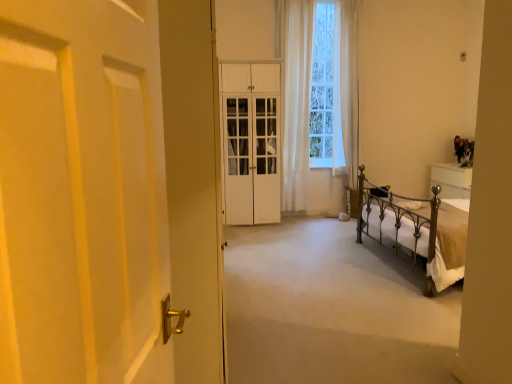
Question: Considering the relative positions of white glossy cabinet at center and white matte door at left in the image provided, is white glossy cabinet at center in front of white matte door at left?

Choices:
 (A) yes
 (B) no

Answer: (B)

Question: Can you confirm if white glossy cabinet at center is bigger than white matte door at left?

Choices:
 (A) yes
 (B) no

Answer: (A)

Question: Does white glossy cabinet at center have a greater height compared to white matte door at left?

Choices:
 (A) yes
 (B) no

Answer: (A)

Question: From the image's perspective, is white glossy cabinet at center under white matte door at left?

Choices:
 (A) no
 (B) yes

Answer: (A)

Question: Is white glossy cabinet at center next to white matte door at left and touching it?

Choices:
 (A) no
 (B) yes

Answer: (A)

Question: Is white matte door at left inside the boundaries of white carpet at center, or outside?

Choices:
 (A) inside
 (B) outside

Answer: (B)

Question: From a real-world perspective, is white matte door at left physically located above or below white carpet at center?

Choices:
 (A) above
 (B) below

Answer: (A)

Question: In terms of height, does white matte door at left look taller or shorter compared to white carpet at center?

Choices:
 (A) tall
 (B) short

Answer: (A)

Question: Considering the positions of white matte door at left and white carpet at center in the image, is white matte door at left wider or thinner than white carpet at center?

Choices:
 (A) wide
 (B) thin

Answer: (B)

Question: From the image's perspective, is white matte door at left located above or below white sheer curtain at center?

Choices:
 (A) above
 (B) below

Answer: (B)

Question: Is white matte door at left inside or outside of white sheer curtain at center?

Choices:
 (A) outside
 (B) inside

Answer: (A)

Question: Is white matte door at left wider or thinner than white sheer curtain at center?

Choices:
 (A) wide
 (B) thin

Answer: (B)

Question: In terms of height, does white matte door at left look taller or shorter compared to white sheer curtain at center?

Choices:
 (A) tall
 (B) short

Answer: (B)

Question: In terms of width, does white glossy cabinet at center look wider or thinner when compared to white matte door at left?

Choices:
 (A) wide
 (B) thin

Answer: (A)

Question: Is white glossy cabinet at center situated inside white matte door at left or outside?

Choices:
 (A) outside
 (B) inside

Answer: (A)